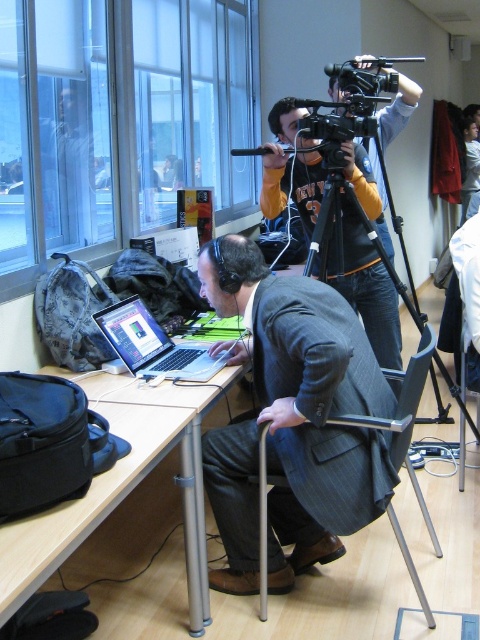
You are standing in front of the desk and want to place a small object on the desk. If you place it closer to the viewer, which of the two points, point (364, 358) or point (406, 253), should you choose?

You should choose point (364, 358) because it is closer to the viewer than point (406, 253).

You are a delivery person who needs to place a small package between the metallic gray chair at center and the black matte tripod at center. Is there enough space to fit the package between them?

The metallic gray chair at center and black matte tripod at center are 34.24 inches apart from each other, so yes, there is enough space to fit the package between them since 34.24 inches is a sufficient distance for a small package.